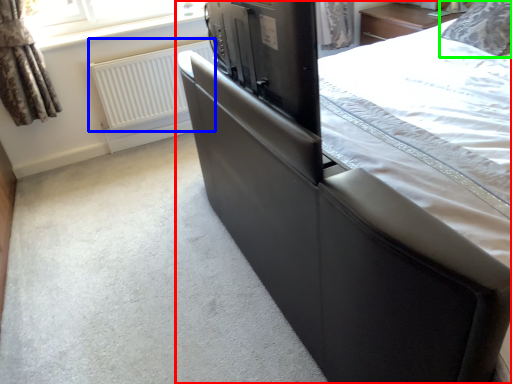
Question: Which is nearer to the bed (highlighted by a red box)? radiator (highlighted by a blue box) or pillow (highlighted by a green box).

Choices:
 (A) radiator
 (B) pillow

Answer: (B)